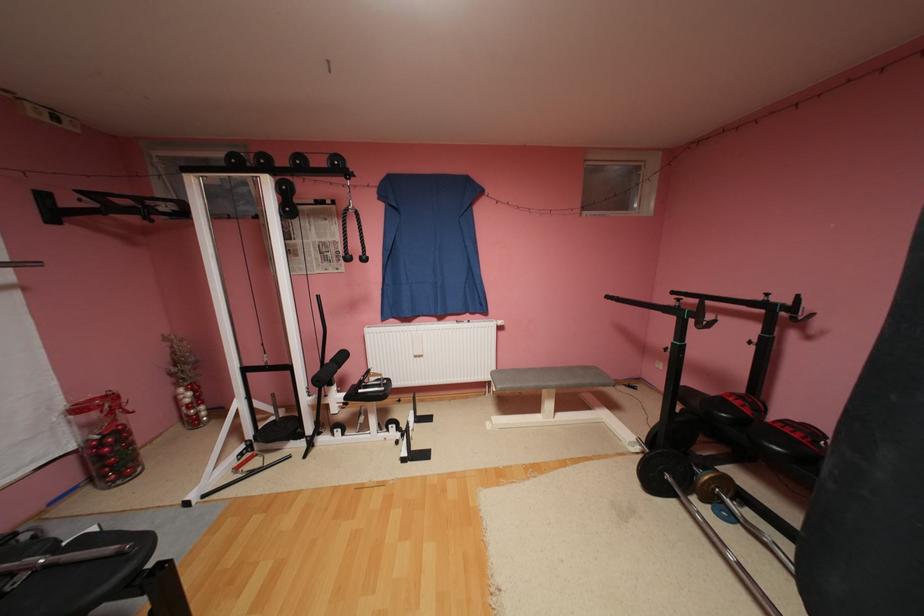
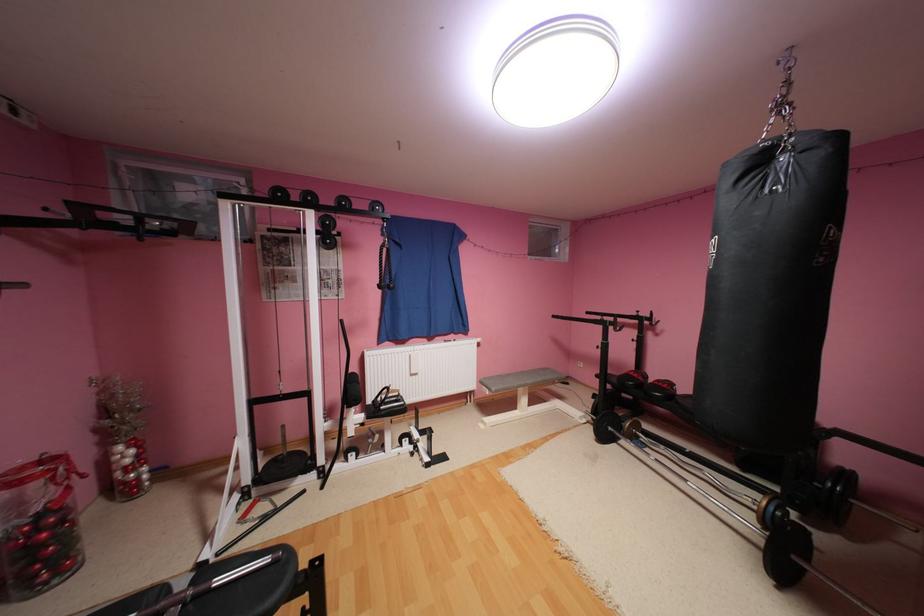
What movement of the cameraman would produce the second image?

The movement direction of the cameraman is left, backward.